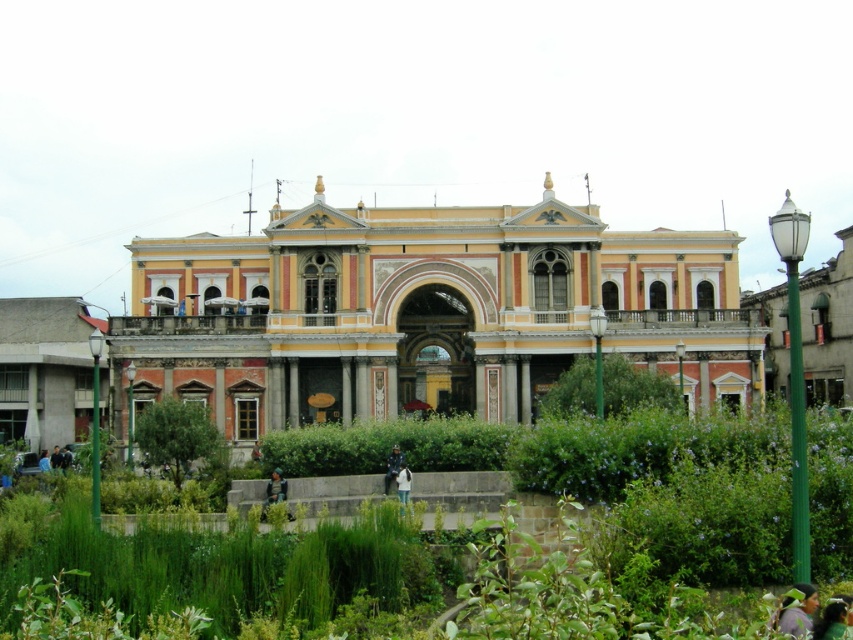
Is point (822, 609) less distant than point (54, 448)?

That is True.

Is green fabric headscarf at lower right taller than dark green fabric jacket at lower left?

Yes.

The width and height of the screenshot is (853, 640). In order to click on green fabric headscarf at lower right in this screenshot , I will do (x=834, y=618).

I want to click on green fabric headscarf at lower right, so click(x=834, y=618).

Is green fabric person at lower right in front of green fabric bag at center?

Yes, green fabric person at lower right is closer to the viewer.

What do you see at coordinates (798, 611) in the screenshot? I see `green fabric person at lower right` at bounding box center [798, 611].

What are the coordinates of `green fabric person at lower right` in the screenshot? It's located at (798, 611).

Can you confirm if green fabric headscarf at lower right is positioned to the right of blue denim jacket at lower left?

Yes, green fabric headscarf at lower right is to the right of blue denim jacket at lower left.

Which is in front, point (833, 614) or point (39, 467)?

Point (833, 614) is in front.

Identify the location of green fabric headscarf at lower right. (834, 618).